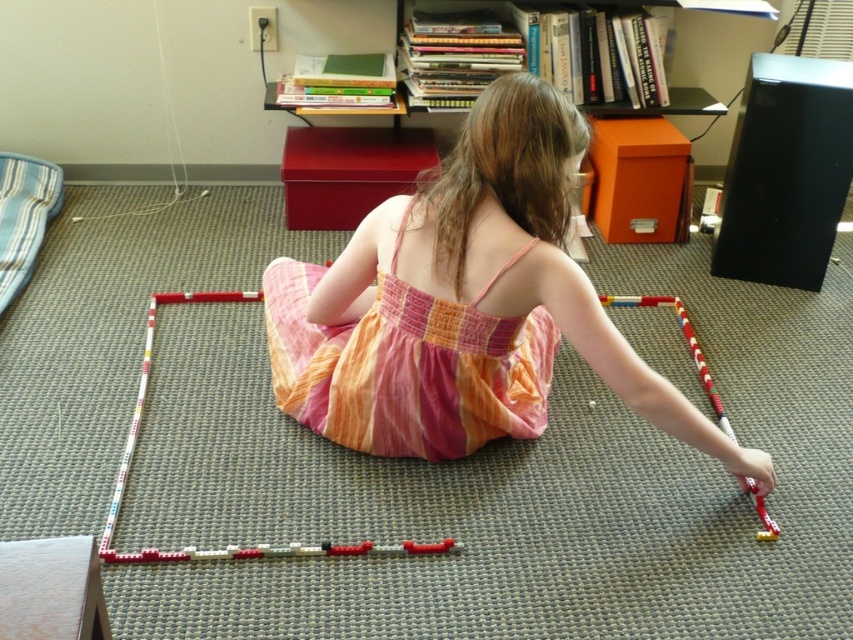
Does multicolored fabric dress at center appear on the right side of translucent plastic toy at lower right?

In fact, multicolored fabric dress at center is to the left of translucent plastic toy at lower right.

Measure the distance between multicolored fabric dress at center and translucent plastic toy at lower right.

They are 33.86 inches apart.

Is point (364, 417) more distant than point (709, 396)?

That is False.

Locate an element on the screen. multicolored fabric dress at center is located at coordinates (467, 305).

Is multicolored fabric dress at center taller than pink cotton dress at center?

Indeed, multicolored fabric dress at center has a greater height compared to pink cotton dress at center.

Does multicolored fabric dress at center appear on the left side of pink cotton dress at center?

No, multicolored fabric dress at center is not to the left of pink cotton dress at center.

Who is more forward, (573,120) or (537,342)?

Point (573,120) is in front.

Locate an element on the screen. multicolored fabric dress at center is located at coordinates (467, 305).

From the picture: Is pink cotton dress at center shorter than translucent plastic toy at lower right?

No.

Is point (463, 340) farther from camera compared to point (761, 506)?

No, (463, 340) is in front of (761, 506).

Which is behind, point (328, 384) or point (718, 422)?

Point (718, 422)

At what (x,y) coordinates should I click in order to perform the action: click on pink cotton dress at center. Please return your answer as a coordinate pair (x, y). Looking at the image, I should click on (407, 364).